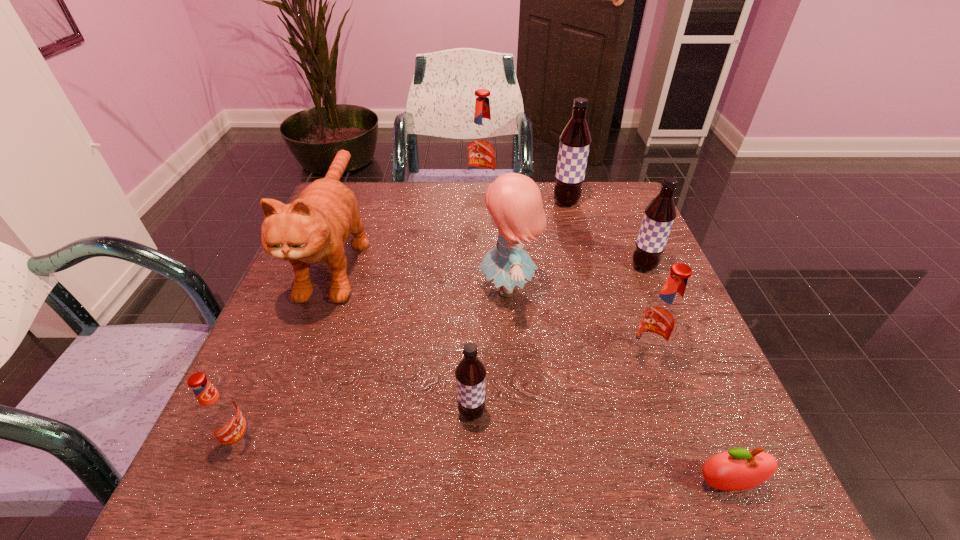
What are the coordinates of `vacant space located on the front-facing side of the blue doll` in the screenshot? It's located at (348, 288).

Where is `vacant region located 0.330m on the face of the orange cat`? The height and width of the screenshot is (540, 960). vacant region located 0.330m on the face of the orange cat is located at coordinates (252, 485).

At what (x,y) coordinates should I click in order to perform the action: click on vacant space located on the back of the fourth nearest root beer. Please return your answer as a coordinate pair (x, y). Looking at the image, I should click on (626, 226).

Locate an element on the screen. The width and height of the screenshot is (960, 540). vacant area situated on the back of the rightmost red root beer is located at coordinates pos(608,249).

This screenshot has height=540, width=960. In order to click on free spot located on the right of the leftmost root beer in this screenshot , I will do `click(302, 442)`.

This screenshot has height=540, width=960. I want to click on blank space located on the left of the fifth farthest root beer, so click(266, 413).

Find the location of a particular element. The width and height of the screenshot is (960, 540). vacant space situated on the back of the shortest object is located at coordinates (663, 329).

This screenshot has width=960, height=540. In order to click on cat present at the far edge in this screenshot , I will do pyautogui.click(x=316, y=226).

The height and width of the screenshot is (540, 960). In order to click on root beer that is at the near edge in this screenshot , I will do `click(220, 414)`.

The height and width of the screenshot is (540, 960). In order to click on apple present at the near edge in this screenshot , I will do `click(737, 469)`.